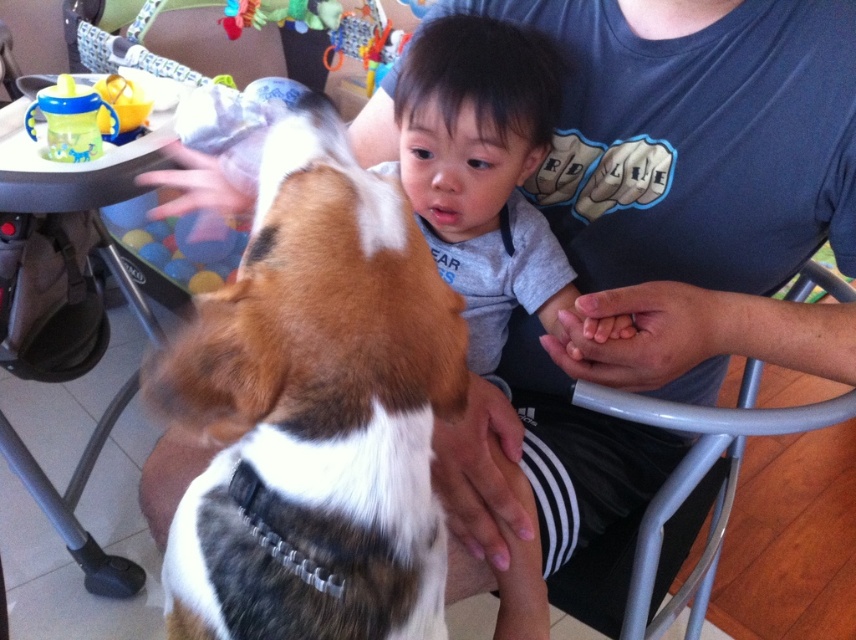
Is brown and white fur at center below translucent plastic sippy cup at upper left?

Indeed, brown and white fur at center is positioned under translucent plastic sippy cup at upper left.

Is brown and white fur at center closer to camera compared to translucent plastic sippy cup at upper left?

Yes.

Where is `brown and white fur at center`? This screenshot has height=640, width=856. brown and white fur at center is located at coordinates (314, 410).

Find the location of a particular element. This screenshot has height=640, width=856. brown and white fur at center is located at coordinates point(314,410).

Is point (589, 404) farther from viewer compared to point (84, 120)?

No, it is not.

Does point (810, 259) come closer to viewer compared to point (33, 99)?

That is True.

The width and height of the screenshot is (856, 640). In order to click on gray plastic chair at center in this screenshot , I will do `click(676, 508)`.

Between brown and white fur at center and gray plastic chair at center, which one is positioned higher?

Positioned higher is brown and white fur at center.

Can you confirm if brown and white fur at center is positioned to the left of gray plastic chair at center?

Yes, brown and white fur at center is to the left of gray plastic chair at center.

Is point (431, 324) less distant than point (670, 616)?

Yes, it is.

Where is `brown and white fur at center`? brown and white fur at center is located at coordinates (314, 410).